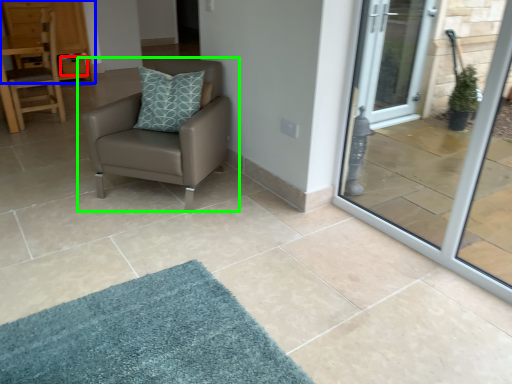
Question: Estimate the real-world distances between objects in this image. Which object is farther from drawer (highlighted by a red box), dresser (highlighted by a blue box) or chair (highlighted by a green box)?

Choices:
 (A) dresser
 (B) chair

Answer: (B)